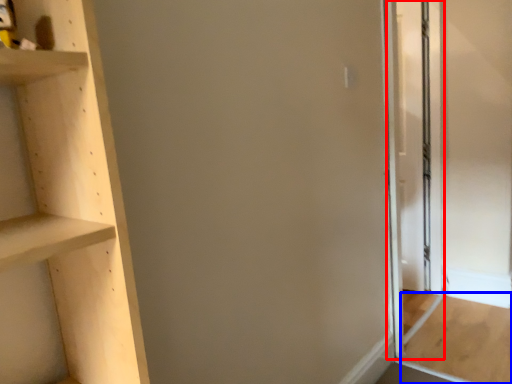
Question: Which object is closer to the camera taking this photo, screen door (highlighted by a red box) or plywood (highlighted by a blue box)?

Choices:
 (A) screen door
 (B) plywood

Answer: (B)